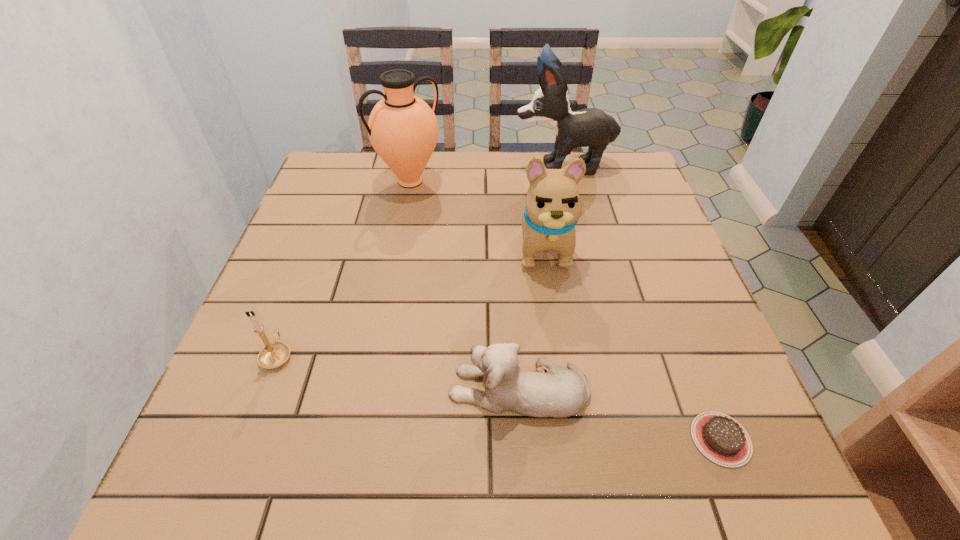
Locate an element on the screen. The image size is (960, 540). free region at the right edge of the desktop is located at coordinates (667, 330).

Where is `vacant space at the far left corner of the desktop`? vacant space at the far left corner of the desktop is located at coordinates (359, 173).

In the image, there is a desktop. Where is `free space at the far right corner`? The height and width of the screenshot is (540, 960). free space at the far right corner is located at coordinates (599, 174).

This screenshot has width=960, height=540. Identify the location of vacant space at the near right corner of the desktop. (751, 485).

The image size is (960, 540). What are the coordinates of `free space that is in between the candle holder and the farthest puppy` in the screenshot? It's located at (420, 260).

Locate an element on the screen. free spot between the farthest puppy and the chocolate cake is located at coordinates (641, 302).

The width and height of the screenshot is (960, 540). I want to click on vacant area that lies between the leftmost object and the farthest puppy, so click(420, 260).

Find the location of a particular element. The height and width of the screenshot is (540, 960). free space between the candle holder and the second shortest puppy is located at coordinates (411, 300).

This screenshot has height=540, width=960. I want to click on free point between the shortest puppy and the fourth nearest object, so click(x=531, y=317).

Image resolution: width=960 pixels, height=540 pixels. In order to click on vacant area that lies between the shortest puppy and the pitcher in this screenshot , I will do [465, 285].